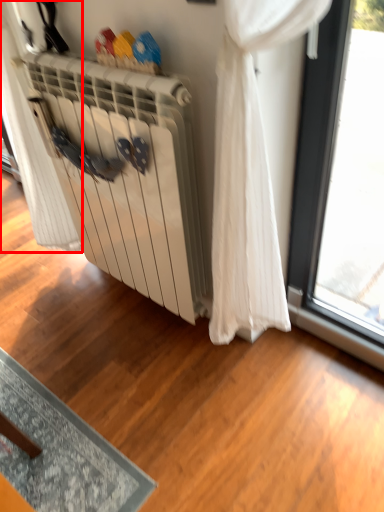
Question: Where is curtain (annotated by the red box) located in relation to radiator in the image?

Choices:
 (A) right
 (B) left

Answer: (B)